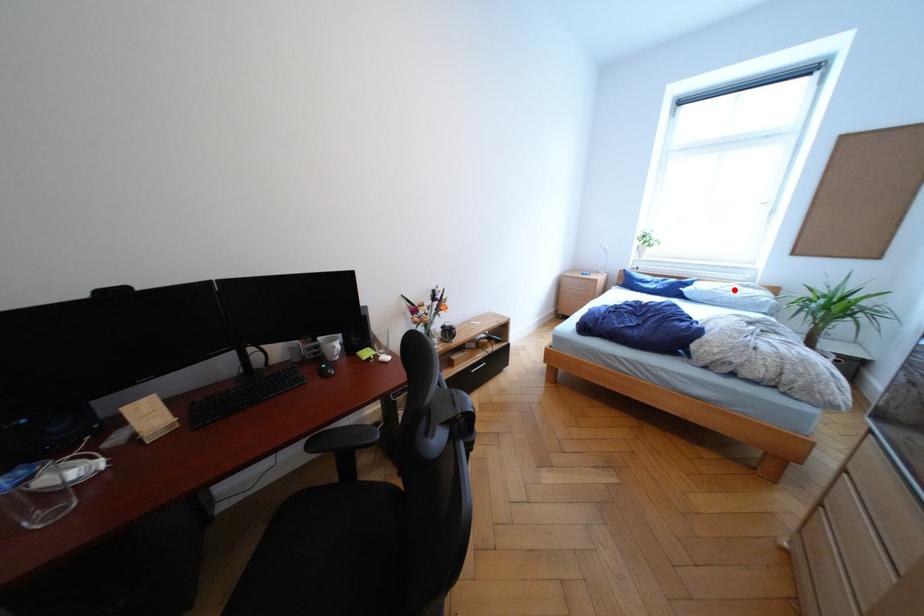
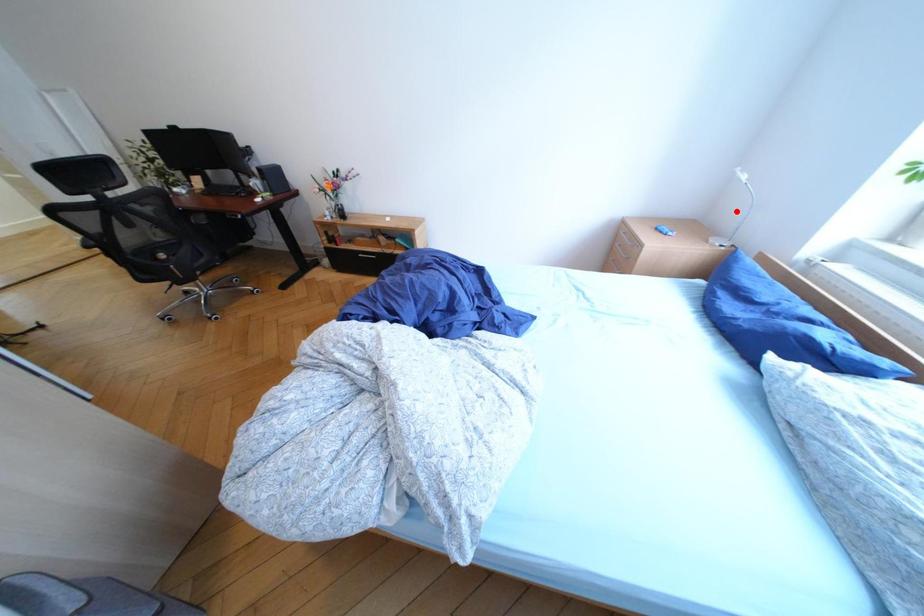
I am providing you with two images of the same scene from different viewpoints. A red point is marked on the first image and another point is marked on the second image. Is the red point in image1 aligned with the point shown in image2?

No